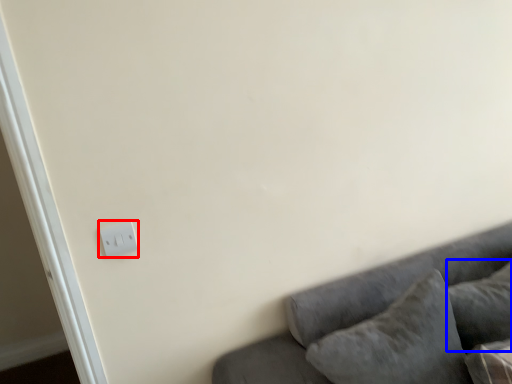
Question: Which object appears closest to the camera in this image, light switch (highlighted by a red box) or pillow (highlighted by a blue box)?

Choices:
 (A) light switch
 (B) pillow

Answer: (B)